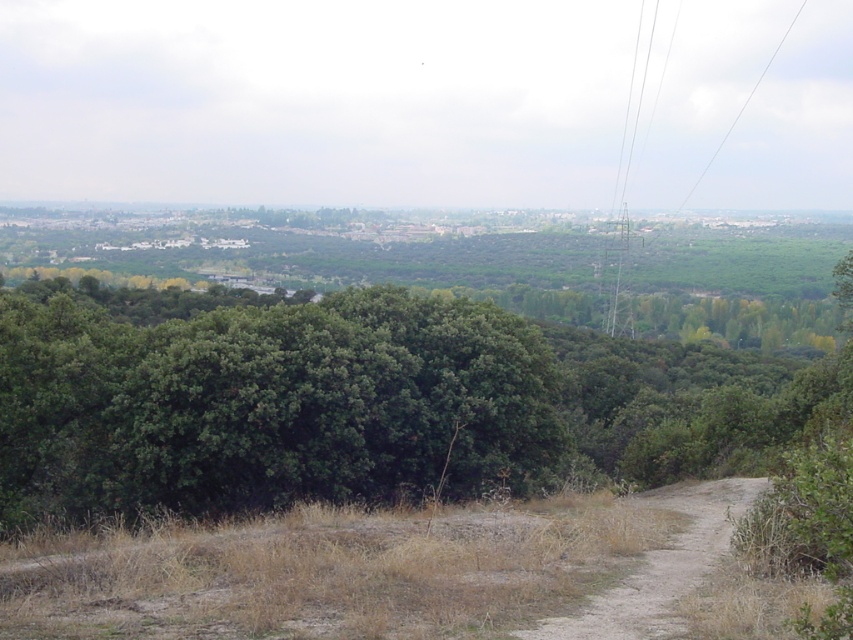
You are standing at the center of the image and want to find the dirt path at lower right. Which direction should you look to locate it?

The dirt path at lower right is located at the coordinates (660, 566), so you should look towards the lower right direction to find it.

You are standing at the center of the dirt path in the foreground. You want to walk to the point marked at coordinates (660, 566). Is the dirt path at lower right the correct direction to go?

Yes, the dirt path at lower right leads to the point marked at coordinates (660, 566), so you should head in that direction.

You are standing at the starting point of the dirt path at lower right and want to reach the green leafy tree at center. Which direction should you head towards?

The green leafy tree at center is positioned on the right side of the dirt path at lower right, so you should head towards the right direction to reach it.